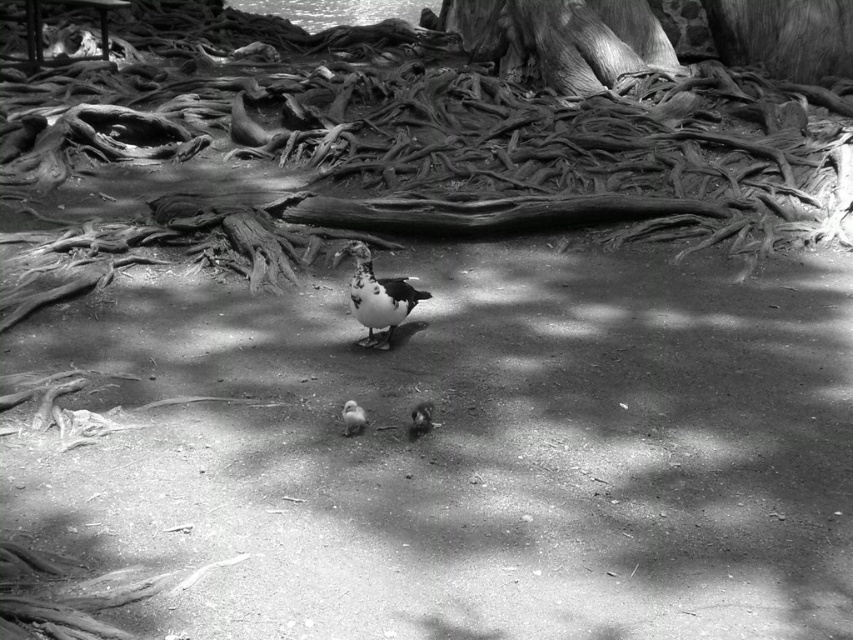
Is rough bark tree trunk at upper center below dark gray matte pigeon at center?

Incorrect, rough bark tree trunk at upper center is not positioned below dark gray matte pigeon at center.

Who is shorter, rough bark tree trunk at upper center or dark gray matte pigeon at center?

dark gray matte pigeon at center is shorter.

Between point (514, 19) and point (413, 433), which one is positioned in front?

Point (413, 433) is more forward.

I want to click on rough bark tree trunk at upper center, so click(570, 45).

Image resolution: width=853 pixels, height=640 pixels. Describe the element at coordinates (421, 419) in the screenshot. I see `dark gray matte pigeon at center` at that location.

Does dark gray matte pigeon at center have a greater height compared to white fluffy pigeon at center?

Yes, dark gray matte pigeon at center is taller than white fluffy pigeon at center.

Is point (412, 419) closer to camera compared to point (343, 433)?

No, it is not.

What are the coordinates of `dark gray matte pigeon at center` in the screenshot? It's located at (421, 419).

Is rough bark tree trunk at upper center smaller than white fluffy pigeon at center?

Actually, rough bark tree trunk at upper center might be larger than white fluffy pigeon at center.

Can you confirm if rough bark tree trunk at upper center is positioned above white fluffy pigeon at center?

Indeed, rough bark tree trunk at upper center is positioned over white fluffy pigeon at center.

Locate an element on the screen. This screenshot has width=853, height=640. rough bark tree trunk at upper center is located at coordinates (570, 45).

I want to click on rough bark tree trunk at upper center, so click(x=570, y=45).